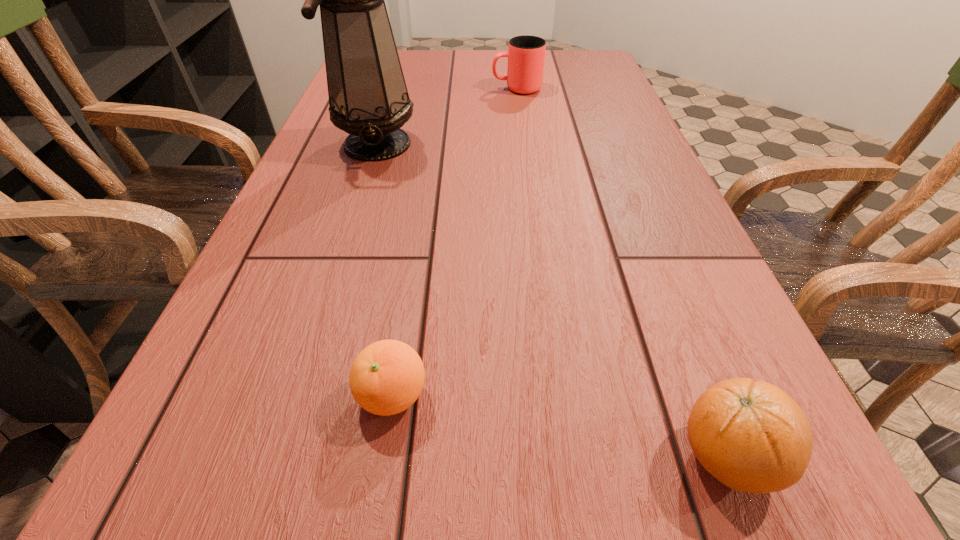
Identify which object is the nearest to the second object from right to left. Please provide its 2D coordinates. Your answer should be formatted as a tuple, i.e. [(x, y)], where the tuple contains the x and y coordinates of a point satisfying the conditions above.

[(368, 98)]

Select which object appears as the third closest to the rightmost object. Please provide its 2D coordinates. Your answer should be formatted as a tuple, i.e. [(x, y)], where the tuple contains the x and y coordinates of a point satisfying the conditions above.

[(526, 54)]

Image resolution: width=960 pixels, height=540 pixels. I want to click on free space in the image that satisfies the following two spatial constraints: 1. on the back side of the shorter orange; 2. on the handle side of the cup, so click(x=439, y=89).